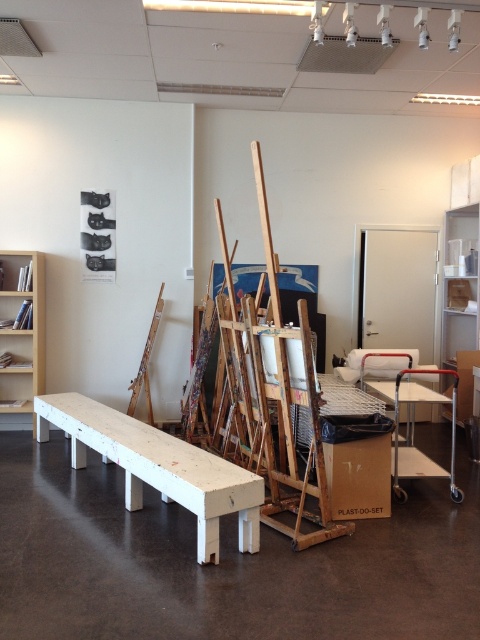
Is wooden easels at center shorter than white wood bench at center?

In fact, wooden easels at center may be taller than white wood bench at center.

Does wooden easels at center lie behind white wood bench at center?

Yes, wooden easels at center is behind white wood bench at center.

Is point (271, 305) less distant than point (248, 476)?

No.

The height and width of the screenshot is (640, 480). I want to click on wooden easels at center, so tap(272, 394).

Can you confirm if cardboard box at center is thinner than light brown wooden bookshelf at left?

In fact, cardboard box at center might be wider than light brown wooden bookshelf at left.

Between point (387, 429) and point (0, 292), which one is positioned behind?

Point (0, 292)

Identify the location of cardboard box at center. (358, 465).

Where is `wooden easels at center`? wooden easels at center is located at coordinates (272, 394).

Can you confirm if wooden easels at center is shorter than white plastic bookshelf at right?

In fact, wooden easels at center may be taller than white plastic bookshelf at right.

The image size is (480, 640). Find the location of `wooden easels at center`. wooden easels at center is located at coordinates (272, 394).